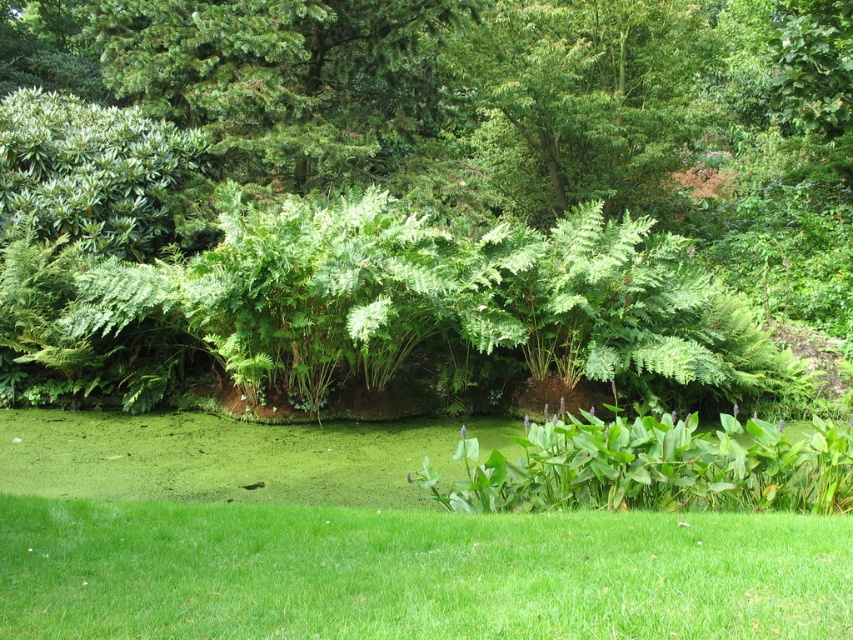
Is point (605, 531) behind point (543, 134)?

No.

Can you confirm if green grass at lower center is thinner than green leafy tree at upper center?

In fact, green grass at lower center might be wider than green leafy tree at upper center.

At what (x,y) coordinates should I click in order to perform the action: click on green grass at lower center. Please return your answer as a coordinate pair (x, y). Looking at the image, I should click on (415, 572).